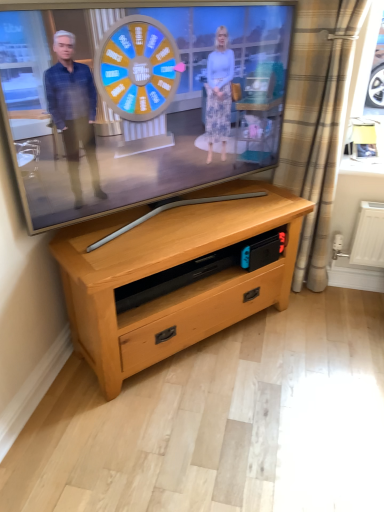
Question: From the image's perspective, is beige plaid curtain at right below matte wooden tv at center?

Choices:
 (A) no
 (B) yes

Answer: (B)

Question: Is beige plaid curtain at right behind matte wooden tv at center?

Choices:
 (A) yes
 (B) no

Answer: (A)

Question: Does beige plaid curtain at right have a greater width compared to matte wooden tv at center?

Choices:
 (A) no
 (B) yes

Answer: (A)

Question: Is beige plaid curtain at right completely or partially outside of matte wooden tv at center?

Choices:
 (A) no
 (B) yes

Answer: (B)

Question: Is the surface of beige plaid curtain at right in direct contact with matte wooden tv at center?

Choices:
 (A) yes
 (B) no

Answer: (B)

Question: From the image's perspective, is light wood chest of drawers at center located above or below beige plaid curtain at right?

Choices:
 (A) above
 (B) below

Answer: (B)

Question: Looking at the image, does light wood chest of drawers at center seem bigger or smaller compared to beige plaid curtain at right?

Choices:
 (A) big
 (B) small

Answer: (A)

Question: In the image, is light wood chest of drawers at center positioned in front of or behind beige plaid curtain at right?

Choices:
 (A) behind
 (B) front

Answer: (B)

Question: Is light wood chest of drawers at center situated inside beige plaid curtain at right or outside?

Choices:
 (A) inside
 (B) outside

Answer: (B)

Question: Is point (304, 177) closer or farther from the camera than point (157, 151)?

Choices:
 (A) farther
 (B) closer

Answer: (A)

Question: In terms of width, does beige plaid curtain at right look wider or thinner when compared to matte wooden tv at center?

Choices:
 (A) thin
 (B) wide

Answer: (A)

Question: From a real-world perspective, is beige plaid curtain at right above or below matte wooden tv at center?

Choices:
 (A) above
 (B) below

Answer: (B)

Question: Considering their positions, is beige plaid curtain at right located in front of or behind matte wooden tv at center?

Choices:
 (A) front
 (B) behind

Answer: (B)

Question: Based on their sizes in the image, would you say matte wooden tv at center is bigger or smaller than light wood chest of drawers at center?

Choices:
 (A) small
 (B) big

Answer: (A)

Question: Considering the positions of point (157, 132) and point (87, 271), is point (157, 132) closer or farther from the camera than point (87, 271)?

Choices:
 (A) farther
 (B) closer

Answer: (A)